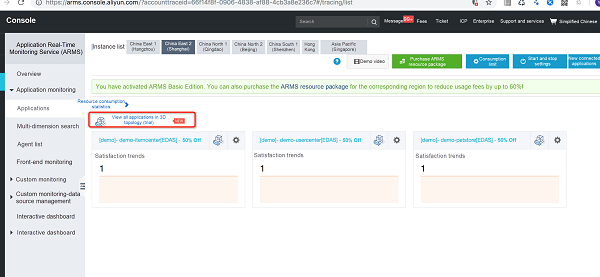
Image resolution: width=600 pixels, height=277 pixels. What are the coordinates of `pink box` in the screenshot? It's located at (164, 188), (341, 198), (481, 185).